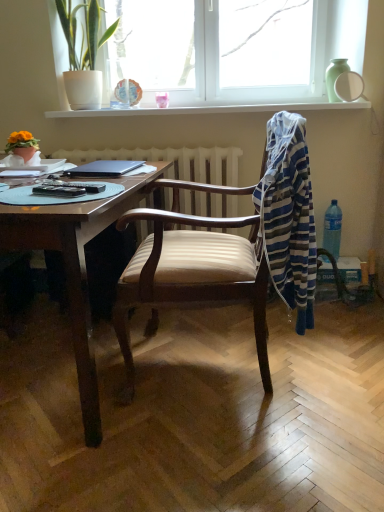
Find the location of a particular element. The width and height of the screenshot is (384, 512). vacant space in front of wooden chair at center is located at coordinates (215, 459).